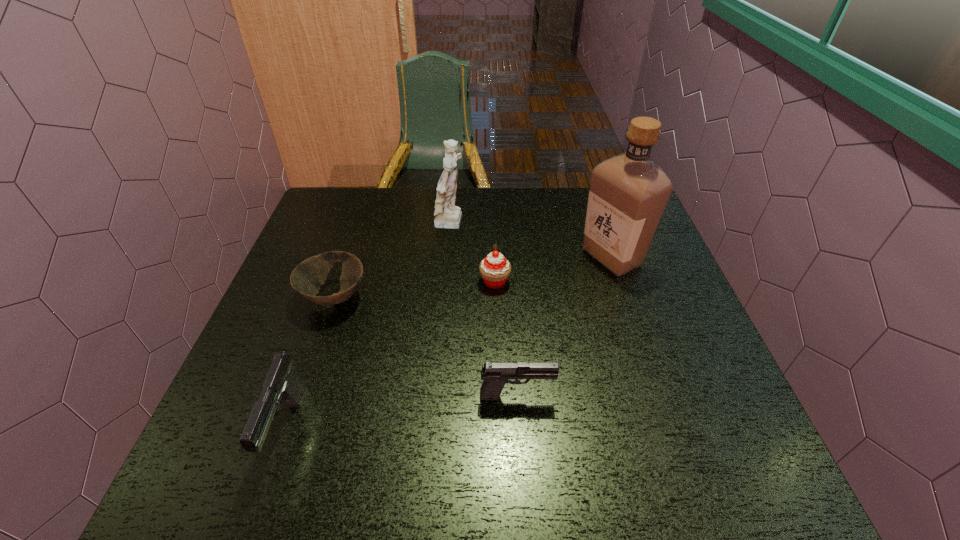
The image size is (960, 540). In order to click on the left pistol in this screenshot , I will do pos(281,384).

The image size is (960, 540). What are the coordinates of `the taller pistol` in the screenshot? It's located at (281, 384).

Locate an element on the screen. the shorter pistol is located at coordinates (495, 375).

This screenshot has height=540, width=960. What are the coordinates of `cupcake` in the screenshot? It's located at (495, 268).

The height and width of the screenshot is (540, 960). What are the coordinates of `the rightmost object` in the screenshot? It's located at (628, 194).

You are a GUI agent. You are given a task and a screenshot of the screen. Output one action in this format:
    pyautogui.click(x=<x>, y=<y>)
    Task: Click on the liquor
    
    Given the screenshot: What is the action you would take?
    pyautogui.click(x=628, y=194)

Where is `figurine`? The width and height of the screenshot is (960, 540). figurine is located at coordinates (447, 215).

The image size is (960, 540). What are the coordinates of `the third object from left to right` in the screenshot? It's located at pyautogui.click(x=447, y=215).

Locate an element on the screen. The width and height of the screenshot is (960, 540). bowl is located at coordinates (306, 279).

You are a GUI agent. You are given a task and a screenshot of the screen. Output one action in this format:
    pyautogui.click(x=<x>, y=<y>)
    Task: Click on the free space located aim along the barrel of the right pistol
    
    Given the screenshot: What is the action you would take?
    pyautogui.click(x=601, y=395)